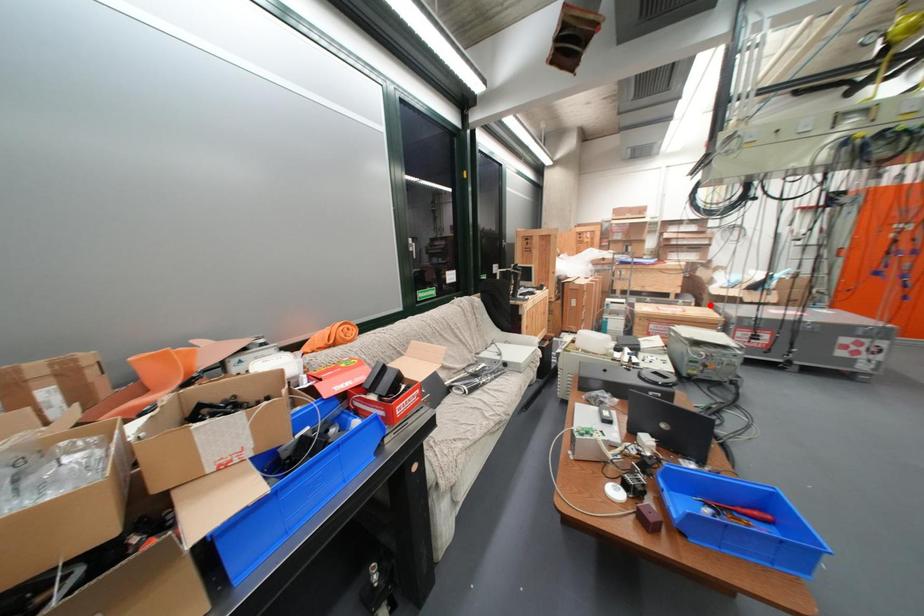
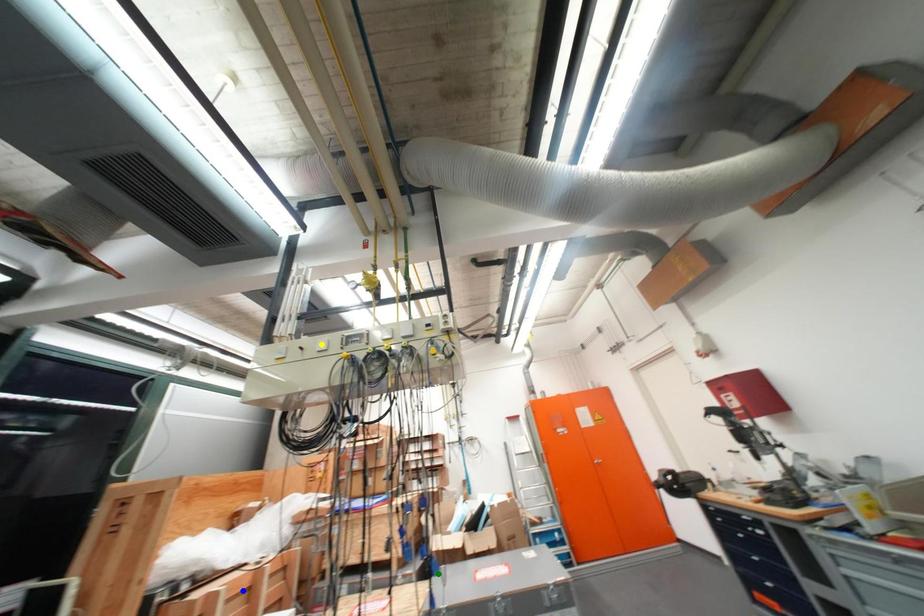
Question: I am providing you with two images of the same scene from different viewpoints. A red point is marked on the first image. You are given multiple points on the second image. Can you choose the point in image 2 that corresponds to the point in image 1?

Choices:
 (A) blue point
 (B) green point
 (C) yellow point

Answer: (B)